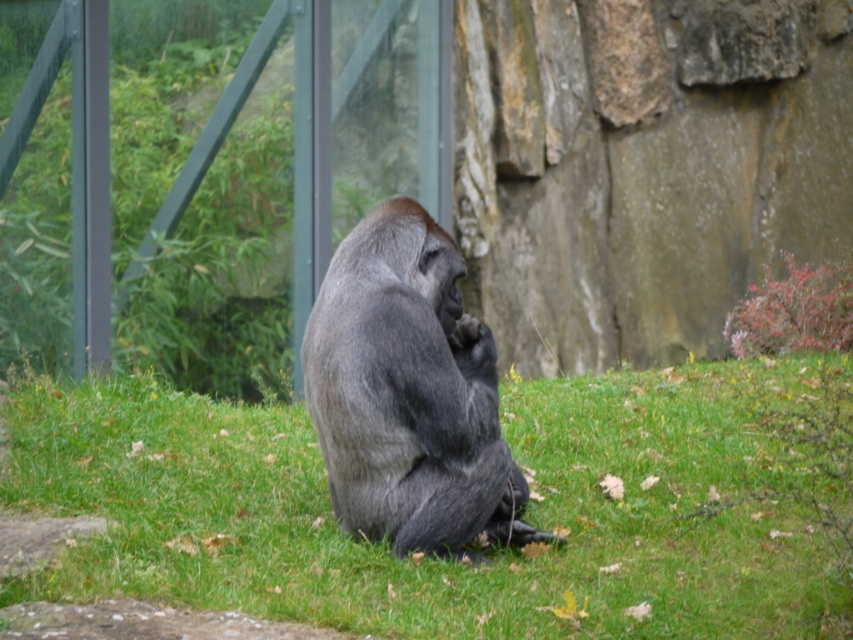
You are a zookeeper standing at the entrance of the gorilla enclosure. You need to place a new feeding tray on the green soft grass at center. If your reach extends 1.5 meters, can you place the feeding tray without moving closer?

The green soft grass at center is 4.73 meters away from the viewer. Since your reach only extends 1.5 meters, you cannot place the feeding tray without moving closer.

Based on the photo, you are standing at the point marked by the coordinates [434,557] in the image. Looking around, you see the green soft grass at center. Can you tell me what object you are standing on?

You are standing on the green soft grass at center as indicated by the coordinates [434,557].

You are a zookeeper who needs to ensure the comfort of the gray fur gorilla at center. Since the enclosure has both green soft grass at center and rocky areas, which surface is the gorilla currently sitting on?

The gray fur gorilla at center is sitting on the green soft grass at center, as the green soft grass at center is positioned under the gray fur gorilla at center.